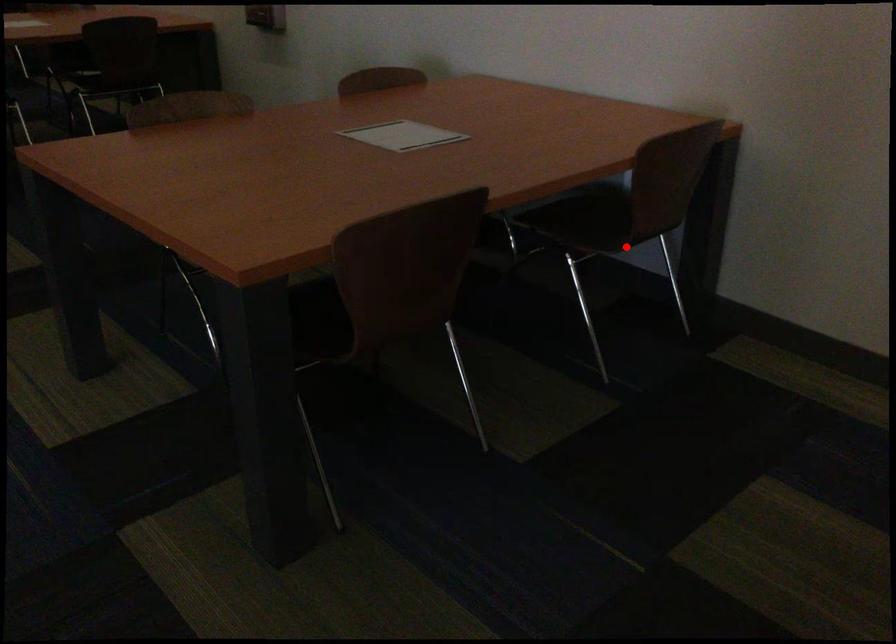
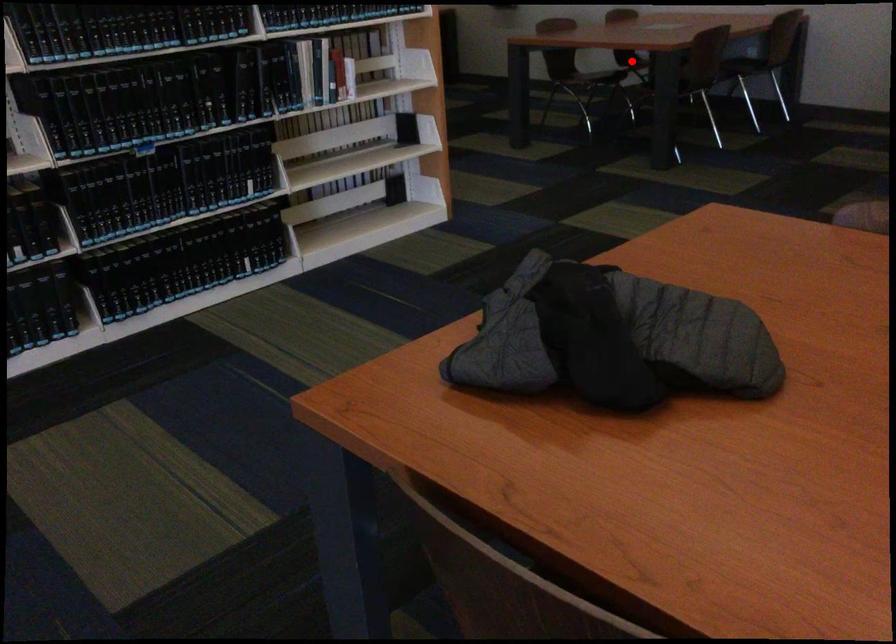
Consider the image. I am providing you with two images of the same scene from different viewpoints. A red point is marked on the first image and another point is marked on the second image. Is the marked point in image1 the same physical position as the marked point in image2?

No